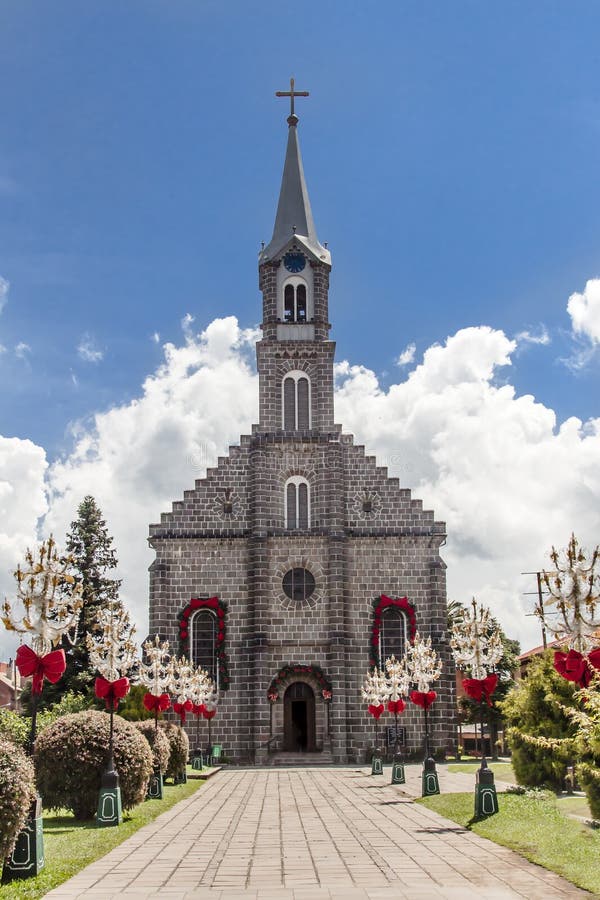
Find the location of a particular element. window is located at coordinates (284, 583).